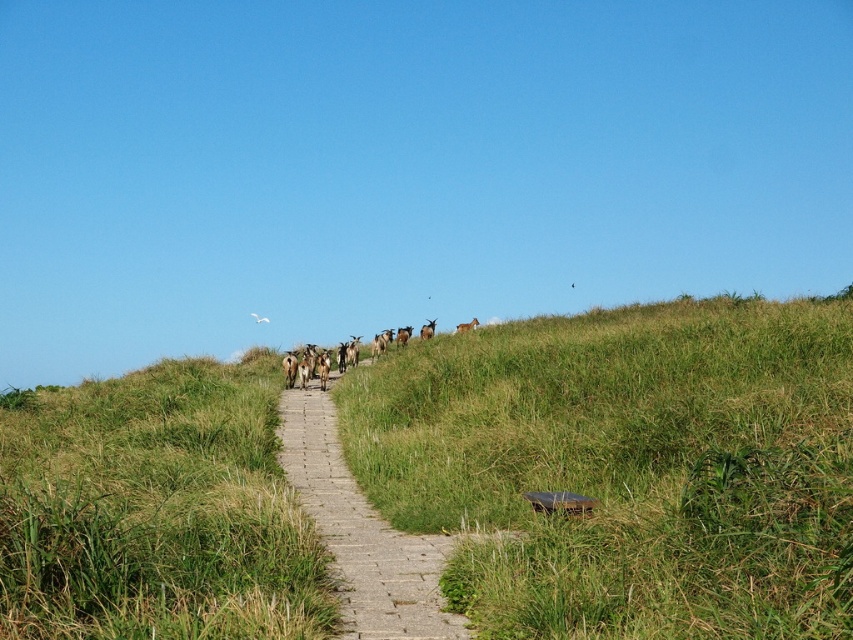
From the picture: You are a hiker standing on the green grassy hillside at center and want to walk towards the brown furry goat at upper center. Is the goat visible from your current position?

The green grassy hillside at center is much taller than the brown furry goat at upper center, so the goat might be partially hidden by the hillside. You may need to move to a higher vantage point to see it clearly.

You are a hiker trying to decide whether to walk on the gray concrete path at center or around it through the grass. Considering the size of the path compared to the brown furry goat at upper center, which option might be more practical for a person to walk on?

The gray concrete path at center is bigger than the brown furry goat at upper center, so walking on the path would be more practical as it provides a wider and more stable surface for a person to walk on compared to the grassy area.

You are standing at the foot of the hill and want to walk towards the animals on the gray concrete path at center. Which direction should you walk relative to the green grassy hillside at center?

You should walk towards the gray concrete path at center, which is behind the green grassy hillside at center, so you need to walk away from the green grassy hillside at center to reach the path.